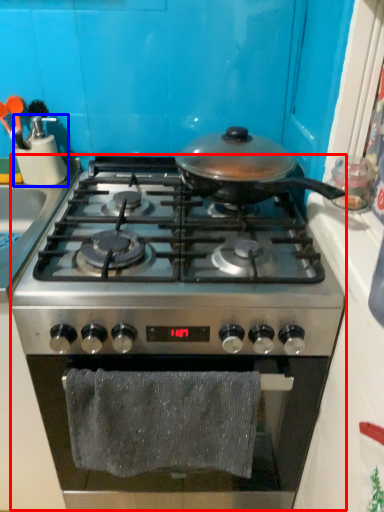
Question: Among these objects, which one is farthest to the camera, gas stove (highlighted by a red box) or kitchen appliance (highlighted by a blue box)?

Choices:
 (A) gas stove
 (B) kitchen appliance

Answer: (B)